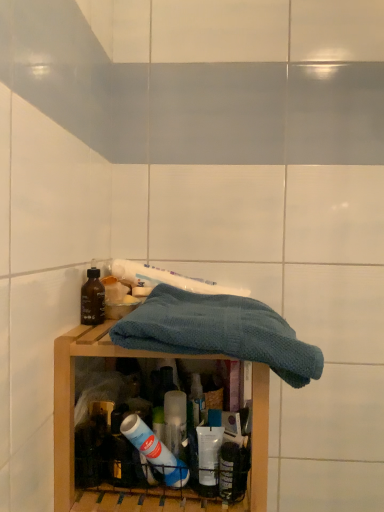
Locate an element on the screen. This screenshot has width=384, height=512. vacant space situated above blue knitted towel at center (from a real-world perspective) is located at coordinates (217, 319).